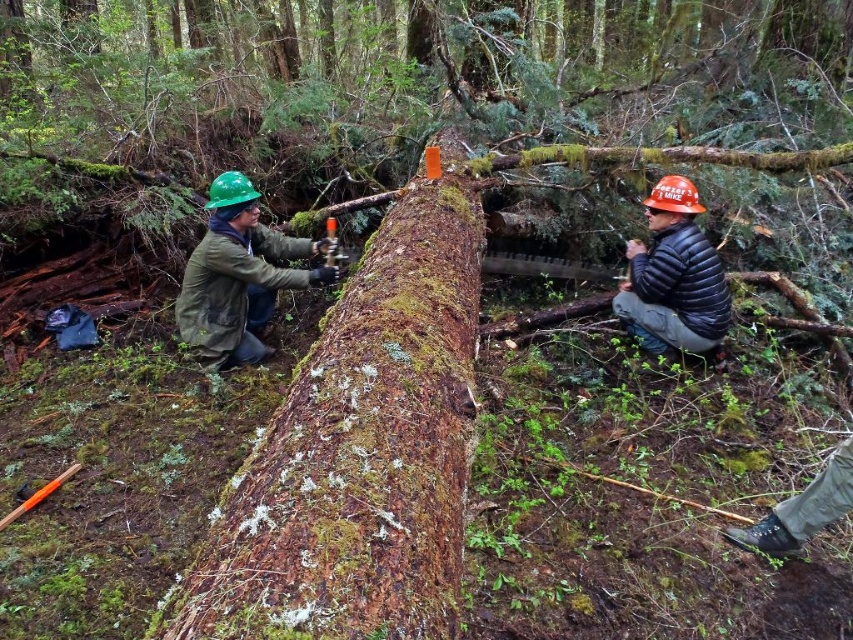
The image size is (853, 640). I want to click on green matte helmet at left, so click(238, 276).

Who is more distant from viewer, [225,296] or [695,300]?

Point [225,296]

Identify the location of green matte helmet at left. (238, 276).

Is moss-covered bark at center below green matte helmet at left?

Yes, moss-covered bark at center is below green matte helmet at left.

Looking at this image, can you confirm if moss-covered bark at center is taller than green matte helmet at left?

Indeed, moss-covered bark at center has a greater height compared to green matte helmet at left.

Who is more forward, [312,484] or [257,248]?

Positioned in front is point [312,484].

Identify the location of moss-covered bark at center. This screenshot has height=640, width=853. (361, 451).

Can you confirm if moss-covered bark at center is taller than orange hard hat at right?

Correct, moss-covered bark at center is much taller as orange hard hat at right.

In the scene shown: Who is taller, moss-covered bark at center or orange hard hat at right?

Standing taller between the two is moss-covered bark at center.

Between point (418, 573) and point (703, 349), which one is positioned behind?

The point (703, 349) is behind.

At what (x,y) coordinates should I click in order to perform the action: click on moss-covered bark at center. Please return your answer as a coordinate pair (x, y). Looking at the image, I should click on (361, 451).